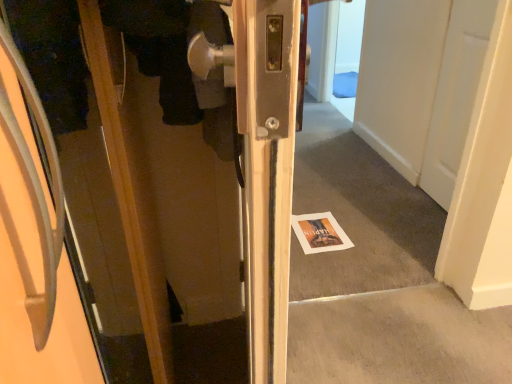
Where is `white paper magazine at center`? white paper magazine at center is located at coordinates click(x=319, y=233).

The height and width of the screenshot is (384, 512). Describe the element at coordinates (319, 233) in the screenshot. I see `white paper magazine at center` at that location.

This screenshot has height=384, width=512. What do you see at coordinates (35, 251) in the screenshot?
I see `matte wood door at left` at bounding box center [35, 251].

Image resolution: width=512 pixels, height=384 pixels. I want to click on matte wood door at left, so (x=35, y=251).

Where is `white paper magazine at center`? This screenshot has height=384, width=512. white paper magazine at center is located at coordinates (319, 233).

Is white paper magazine at center to the left or to the right of matte wood door at left in the image?

Clearly, white paper magazine at center is on the right of matte wood door at left in the image.

Considering the relative positions of white paper magazine at center and matte wood door at left in the image provided, is white paper magazine at center behind matte wood door at left?

Yes, the depth of white paper magazine at center is greater than that of matte wood door at left.

Is point (322, 222) closer or farther from the camera than point (57, 161)?

Point (322, 222) is farther from the camera than point (57, 161).

From the image's perspective, is white paper magazine at center below matte wood door at left?

A: No, from the image's perspective, white paper magazine at center is not below matte wood door at left.

From a real-world perspective, who is located lower, white paper magazine at center or matte wood door at left?

In real-world perspective, white paper magazine at center is lower.

Which of these two, white paper magazine at center or matte wood door at left, is thinner?

white paper magazine at center.

In the scene shown: Does white paper magazine at center have a lesser height compared to matte wood door at left?

Yes.

Which of these two, white paper magazine at center or matte wood door at left, is bigger?

matte wood door at left is bigger.

Is white paper magazine at center completely or partially outside of matte wood door at left?

Yes, white paper magazine at center is located beyond the bounds of matte wood door at left.

Does white paper magazine at center touch matte wood door at left?

No, white paper magazine at center is not touching matte wood door at left.

Is white paper magazine at center aimed at matte wood door at left?

No, white paper magazine at center is not oriented towards matte wood door at left.

You are a GUI agent. You are given a task and a screenshot of the screen. Output one action in this format:
    pyautogui.click(x=<x>, y=<y>)
    Task: Click on the magazine below the matte wood door at left (from a real-world perspective)
    
    Given the screenshot: What is the action you would take?
    pyautogui.click(x=319, y=233)

Based on the photo, between matte wood door at left and white paper magazine at center, which one appears on the left side from the viewer's perspective?

Positioned to the left is matte wood door at left.

Is matte wood door at left closer to camera compared to white paper magazine at center?

Yes, the depth of matte wood door at left is less than that of white paper magazine at center.

Between point (35, 299) and point (325, 226), which one is positioned in front?

The point (35, 299) is in front.

From the image's perspective, is matte wood door at left above or below white paper magazine at center?

Based on their image positions, matte wood door at left is located beneath white paper magazine at center.

From a real-world perspective, which is physically below, matte wood door at left or white paper magazine at center?

In real-world perspective, white paper magazine at center is lower.

Is matte wood door at left wider or thinner than white paper magazine at center?

In the image, matte wood door at left appears to be wider than white paper magazine at center.

Is matte wood door at left taller or shorter than white paper magazine at center?

Clearly, matte wood door at left is taller compared to white paper magazine at center.

Who is bigger, matte wood door at left or white paper magazine at center?

matte wood door at left.

Is matte wood door at left inside or outside of white paper magazine at center?

matte wood door at left is not enclosed by white paper magazine at center.

Are matte wood door at left and white paper magazine at center far apart?

matte wood door at left is far away from white paper magazine at center.

Is matte wood door at left oriented away from white paper magazine at center?

matte wood door at left is not turned away from white paper magazine at center.

How distant is matte wood door at left from white paper magazine at center?

They are 4.97 feet apart.

You are a GUI agent. You are given a task and a screenshot of the screen. Output one action in this format:
    pyautogui.click(x=<x>, y=<y>)
    Task: Click on the magazine below the matte wood door at left (from a real-world perspective)
    The image size is (512, 384).
    Given the screenshot: What is the action you would take?
    pyautogui.click(x=319, y=233)

The image size is (512, 384). Identify the location of door on the left of white paper magazine at center. (35, 251).

The height and width of the screenshot is (384, 512). I want to click on door that appears below the white paper magazine at center (from the image's perspective), so click(35, 251).